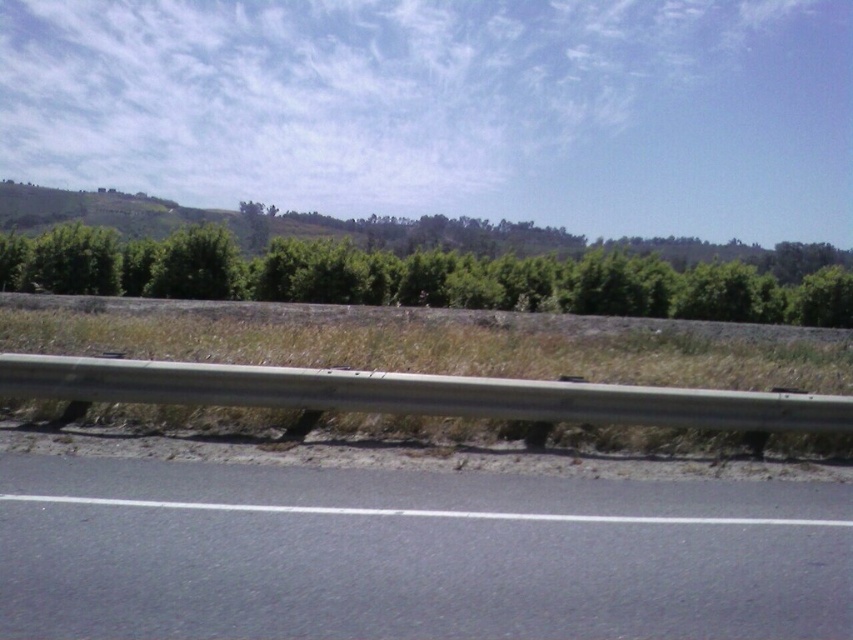
Does black asphalt road at lower center have a greater width compared to green leafy trees at center?

No.

Can you confirm if black asphalt road at lower center is bigger than green leafy trees at center?

No.

Which is in front, point (235, 628) or point (450, 291)?

Point (235, 628) is in front.

At what (x,y) coordinates should I click in order to perform the action: click on black asphalt road at lower center. Please return your answer as a coordinate pair (x, y). Image resolution: width=853 pixels, height=640 pixels. Looking at the image, I should click on (412, 554).